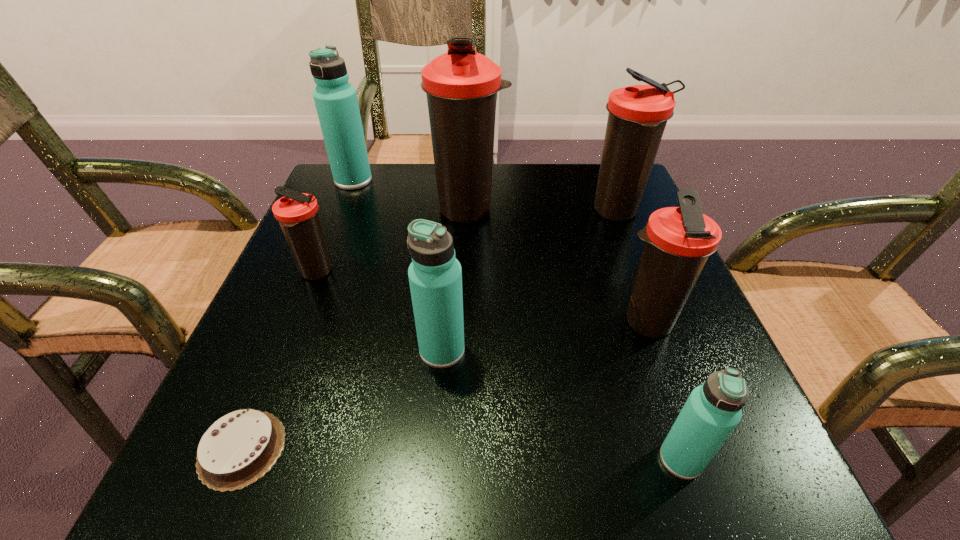
Identify the location of vacant space positioned 0.330m on the right of the shortest object. The image size is (960, 540). (536, 449).

Where is `thermos bottle that is at the near edge`? This screenshot has height=540, width=960. thermos bottle that is at the near edge is located at coordinates (713, 410).

Locate an element on the screen. The image size is (960, 540). chocolate cake at the near edge is located at coordinates tap(241, 447).

This screenshot has width=960, height=540. I want to click on chocolate cake located in the left edge section of the desktop, so click(x=241, y=447).

Locate an element on the screen. The height and width of the screenshot is (540, 960). object at the far left corner is located at coordinates (336, 102).

Locate an element on the screen. object at the near left corner is located at coordinates (241, 447).

Find the location of `object at the far right corner`. object at the far right corner is located at coordinates (638, 114).

I want to click on object that is at the near right corner, so click(x=713, y=410).

Image resolution: width=960 pixels, height=540 pixels. In the image, there is a desktop. Identify the location of free space at the far edge. (433, 208).

The height and width of the screenshot is (540, 960). Find the location of `free spot at the near edge of the desktop`. free spot at the near edge of the desktop is located at coordinates (453, 496).